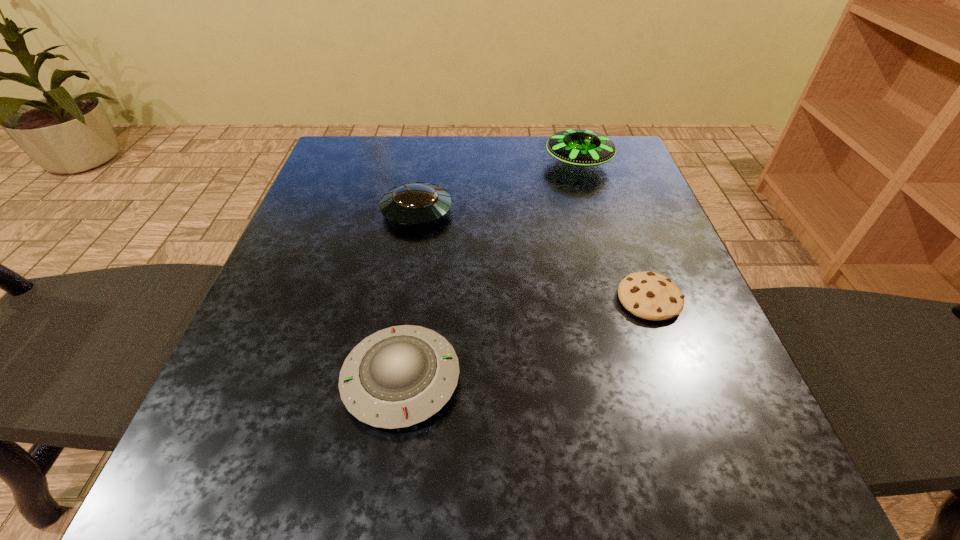
Where is `the third closest object relative to the tallest object`? The width and height of the screenshot is (960, 540). the third closest object relative to the tallest object is located at coordinates (400, 376).

Identify the location of the second closest object relative to the farthest saucer. (648, 295).

Point out which saucer is positioned as the second nearest to the nearest object. Please provide its 2D coordinates. Your answer should be formatted as a tuple, i.e. [(x, y)], where the tuple contains the x and y coordinates of a point satisfying the conditions above.

[(582, 147)]

The height and width of the screenshot is (540, 960). I want to click on saucer that is the second nearest to the second farthest object, so click(400, 376).

Identify the location of vacant space that satisfies the following two spatial constraints: 1. on the front side of the second farthest saucer; 2. on the left side of the nearest saucer. The height and width of the screenshot is (540, 960). (389, 380).

Locate an element on the screen. The width and height of the screenshot is (960, 540). free point that satisfies the following two spatial constraints: 1. on the back side of the nearest saucer; 2. on the right side of the farthest saucer is located at coordinates (433, 163).

This screenshot has height=540, width=960. I want to click on free location that satisfies the following two spatial constraints: 1. on the front side of the nearest saucer; 2. on the right side of the second farthest saucer, so click(389, 380).

Locate an element on the screen. The height and width of the screenshot is (540, 960). free space that satisfies the following two spatial constraints: 1. on the front side of the cookie; 2. on the right side of the second nearest saucer is located at coordinates (402, 299).

Locate an element on the screen. This screenshot has width=960, height=540. vacant space that satisfies the following two spatial constraints: 1. on the back side of the nearest saucer; 2. on the left side of the tallest object is located at coordinates point(433,163).